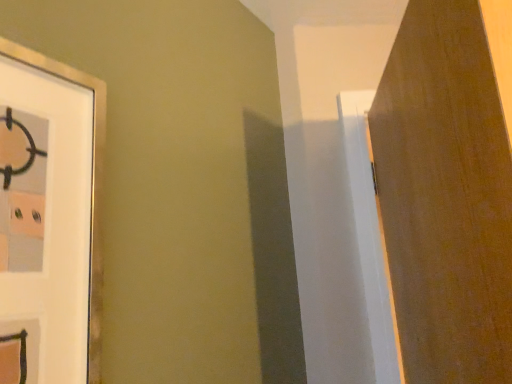
What is the approximate height of wooden door at right?

wooden door at right is 32.50 inches in height.

Describe the element at coordinates (447, 193) in the screenshot. The height and width of the screenshot is (384, 512). I see `wooden door at right` at that location.

At what (x,y) coordinates should I click in order to perform the action: click on wooden door at right. Please return your answer as a coordinate pair (x, y). The height and width of the screenshot is (384, 512). Looking at the image, I should click on (447, 193).

You are a GUI agent. You are given a task and a screenshot of the screen. Output one action in this format:
    pyautogui.click(x=<x>, y=<y>)
    Task: Click on the wooden door at right
    The image size is (512, 384).
    Given the screenshot: What is the action you would take?
    pos(447,193)